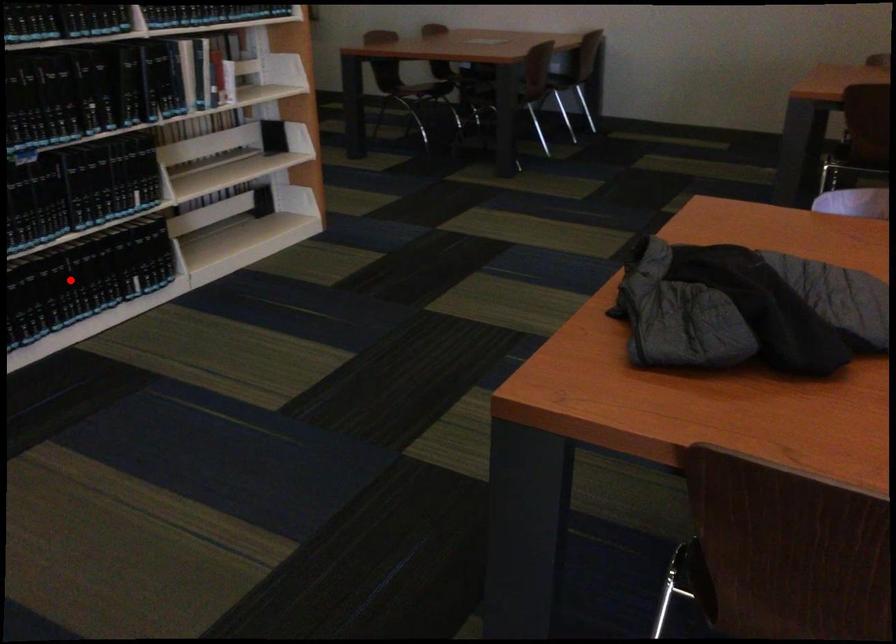
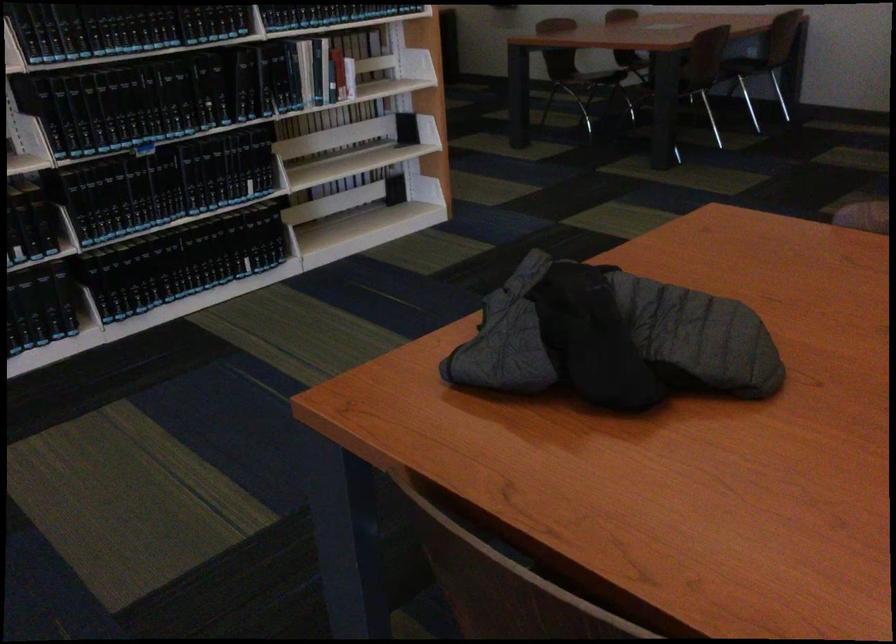
Locate, in the second image, the point that corresponds to the highlighted location in the first image.

(183, 261)